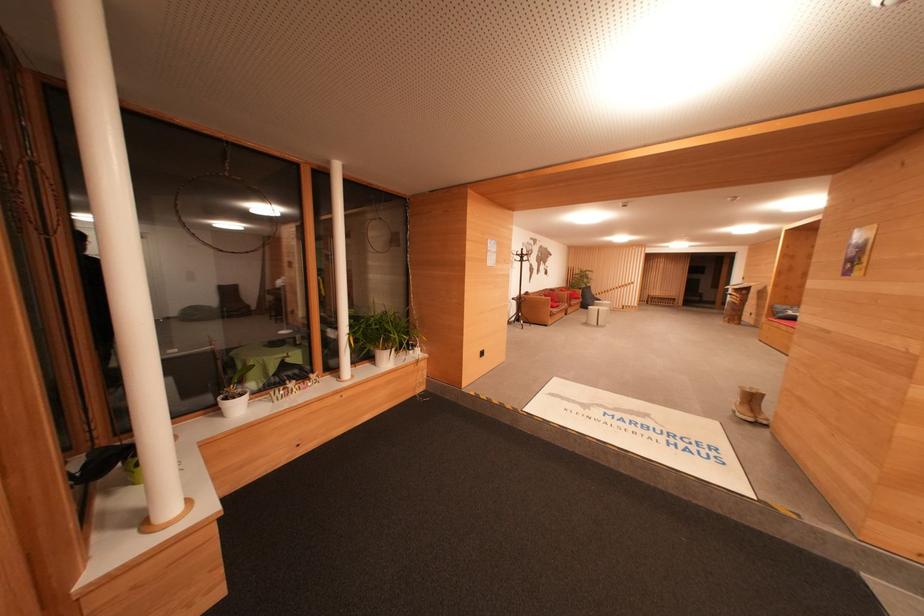
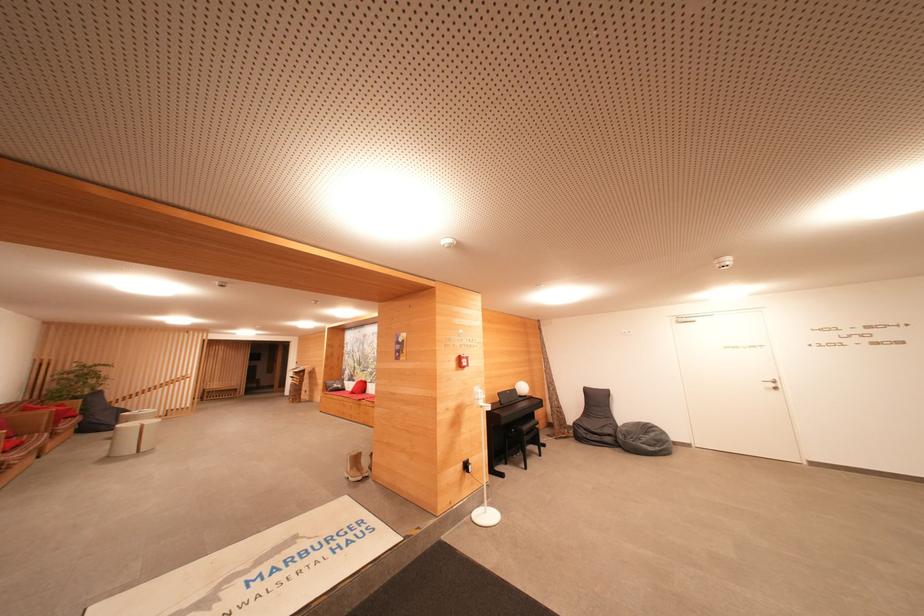
The point at (592, 291) is marked in the first image. Where is the corresponding point in the second image?

(103, 395)